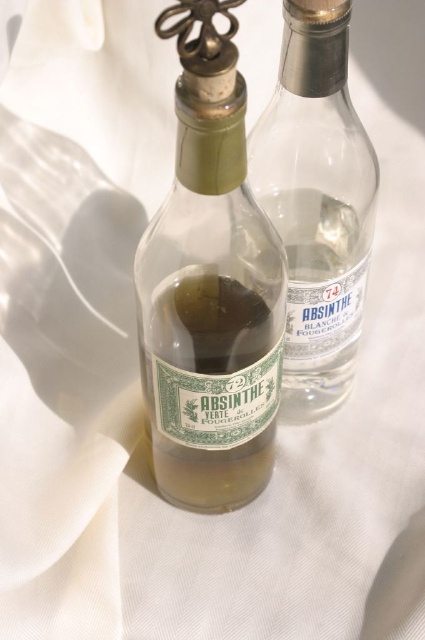
Question: Considering the real-world distances, which object is farthest from the green glass absinthe bottle at center?

Choices:
 (A) green glass absinthe at center
 (B) transparent glass absinthe bottle at center

Answer: (B)

Question: Is green glass absinthe bottle at center closer to camera compared to transparent glass absinthe bottle at center?

Choices:
 (A) yes
 (B) no

Answer: (A)

Question: Among these points, which one is nearest to the camera?

Choices:
 (A) (167, 426)
 (B) (172, 324)
 (C) (353, 371)

Answer: (B)

Question: Is green glass absinthe bottle at center wider than green glass absinthe at center?

Choices:
 (A) yes
 (B) no

Answer: (A)

Question: Can you confirm if transparent glass absinthe bottle at center is thinner than green glass absinthe at center?

Choices:
 (A) no
 (B) yes

Answer: (A)

Question: Which is nearer to the green glass absinthe bottle at center?

Choices:
 (A) transparent glass absinthe bottle at center
 (B) green glass absinthe at center

Answer: (B)